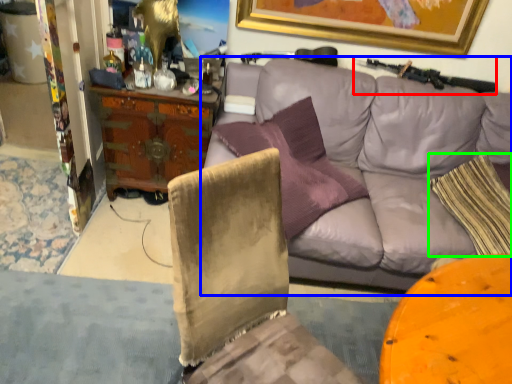
Question: Which object is positioned farthest from shotgun (highlighted by a red box)? Select from studio couch (highlighted by a blue box) and pillow (highlighted by a green box).

Choices:
 (A) studio couch
 (B) pillow

Answer: (B)